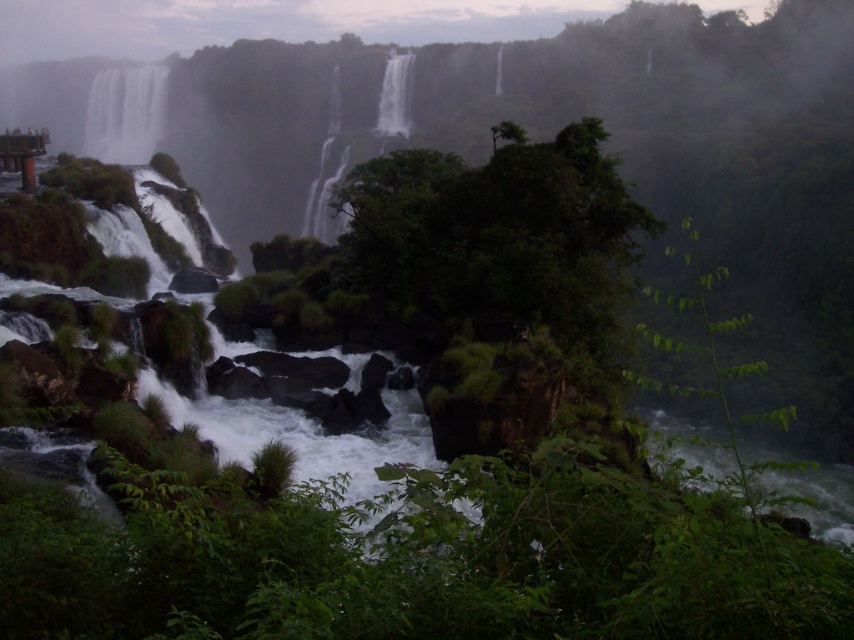
Who is higher up, white misty waterfall at left or white frothy water at center?

white misty waterfall at left is higher up.

Identify the location of white misty waterfall at left. This screenshot has height=640, width=854. (126, 113).

Does white misty waterfall at center have a lesser height compared to white frothy water at center?

No.

Is white misty waterfall at center below white frothy water at center?

Yes.

Locate an element on the screen. The width and height of the screenshot is (854, 640). white misty waterfall at center is located at coordinates (326, 170).

Does white misty waterfall at left have a lesser width compared to white misty waterfall at center?

Incorrect, white misty waterfall at left's width is not less than white misty waterfall at center's.

Who is more distant from viewer, (x=153, y=88) or (x=338, y=131)?

The point (x=153, y=88) is more distant.

I want to click on white misty waterfall at left, so click(x=126, y=113).